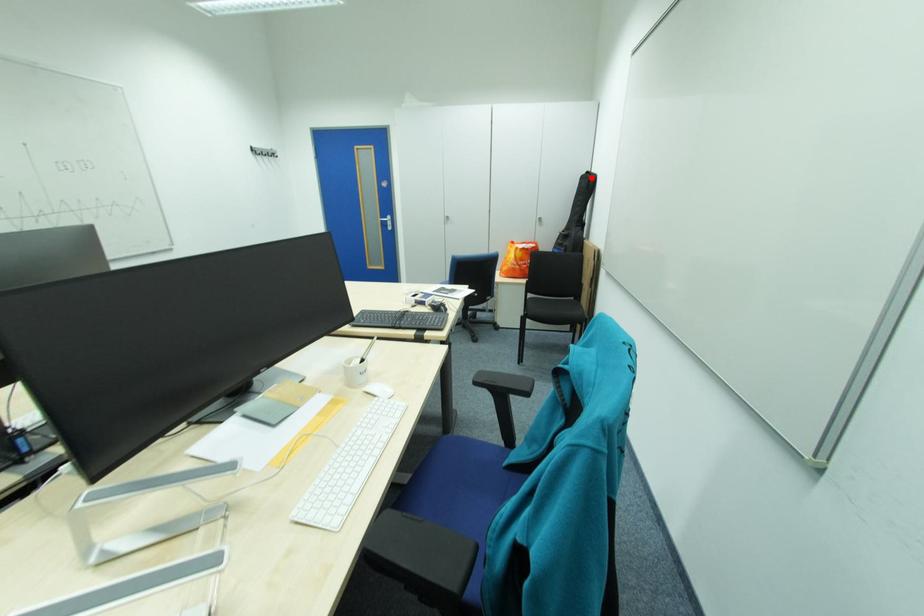
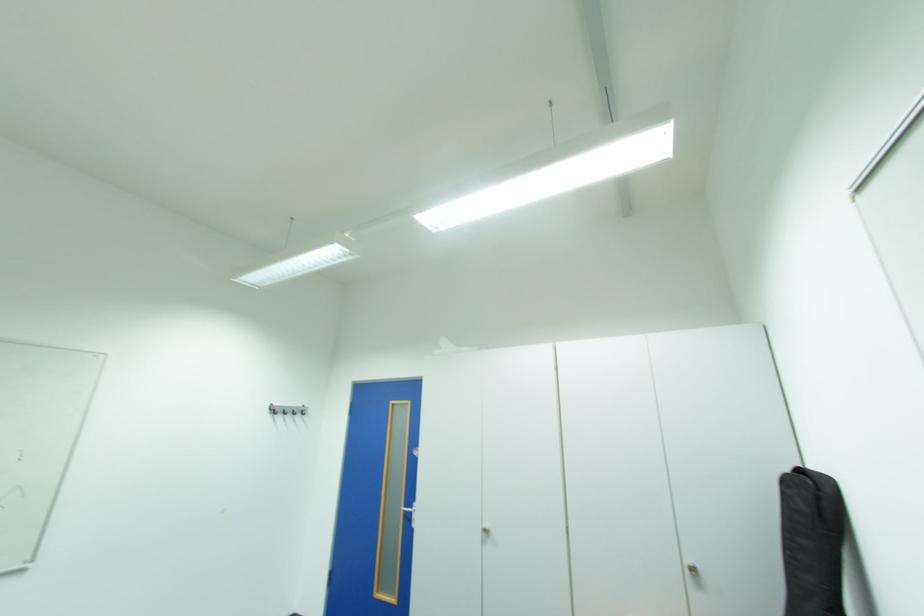
In the second image, find the point that corresponds to the highlighted location in the first image.

(795, 482)